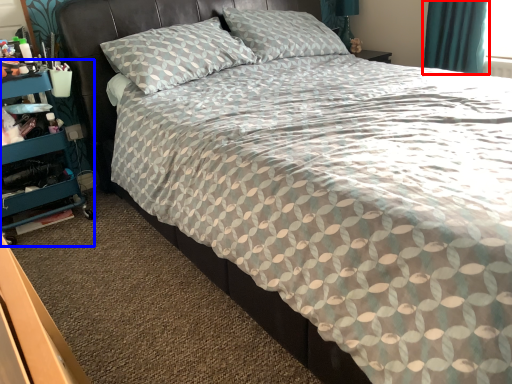
Question: Which of the following is the farthest to the observer, curtain (highlighted by a red box) or dresser (highlighted by a blue box)?

Choices:
 (A) curtain
 (B) dresser

Answer: (A)